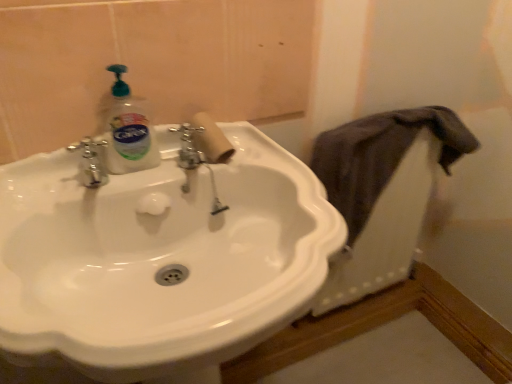
Question: Can you confirm if dark gray fabric at right is positioned to the right of white glossy sink at center?

Choices:
 (A) yes
 (B) no

Answer: (A)

Question: Can you confirm if dark gray fabric at right is taller than white glossy sink at center?

Choices:
 (A) no
 (B) yes

Answer: (A)

Question: Considering the relative sizes of dark gray fabric at right and white glossy sink at center in the image provided, is dark gray fabric at right wider than white glossy sink at center?

Choices:
 (A) yes
 (B) no

Answer: (B)

Question: Could you tell me if dark gray fabric at right is turned towards white glossy sink at center?

Choices:
 (A) yes
 (B) no

Answer: (B)

Question: Is dark gray fabric at right positioned with its back to white glossy sink at center?

Choices:
 (A) no
 (B) yes

Answer: (A)

Question: Does dark gray fabric at right have a larger size compared to white glossy sink at center?

Choices:
 (A) yes
 (B) no

Answer: (B)

Question: Does white cardboard toilet paper at center have a smaller size compared to dark gray fabric at right?

Choices:
 (A) yes
 (B) no

Answer: (A)

Question: From a real-world perspective, is white cardboard toilet paper at center on dark gray fabric at right?

Choices:
 (A) yes
 (B) no

Answer: (A)

Question: Considering the relative sizes of white cardboard toilet paper at center and dark gray fabric at right in the image provided, is white cardboard toilet paper at center thinner than dark gray fabric at right?

Choices:
 (A) no
 (B) yes

Answer: (A)

Question: Considering the relative sizes of white cardboard toilet paper at center and dark gray fabric at right in the image provided, is white cardboard toilet paper at center taller than dark gray fabric at right?

Choices:
 (A) no
 (B) yes

Answer: (A)

Question: Can dark gray fabric at right be found inside white cardboard toilet paper at center?

Choices:
 (A) no
 (B) yes

Answer: (A)

Question: Would you consider white cardboard toilet paper at center to be distant from dark gray fabric at right?

Choices:
 (A) no
 (B) yes

Answer: (A)

Question: Is white glossy sink at center oriented away from dark gray fabric at right?

Choices:
 (A) no
 (B) yes

Answer: (A)